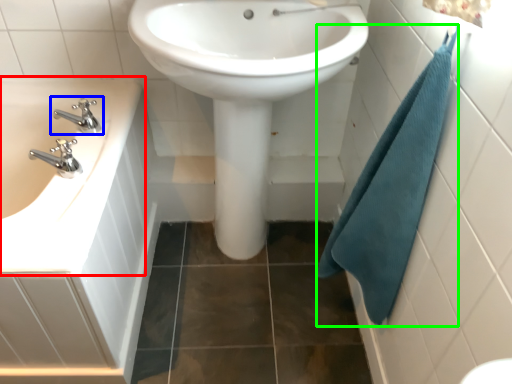
Question: Considering the real-world distances, which object is farthest from sink (highlighted by a red box)? tap (highlighted by a blue box) or bath towel (highlighted by a green box)?

Choices:
 (A) tap
 (B) bath towel

Answer: (B)